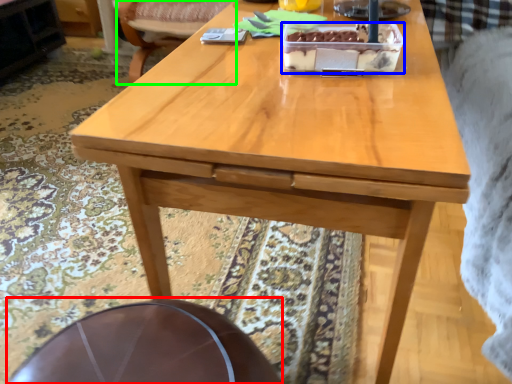
Question: Which object is positioned closest to round table (highlighted by a red box)? Select from cake (highlighted by a blue box) and chair (highlighted by a green box).

Choices:
 (A) cake
 (B) chair

Answer: (A)